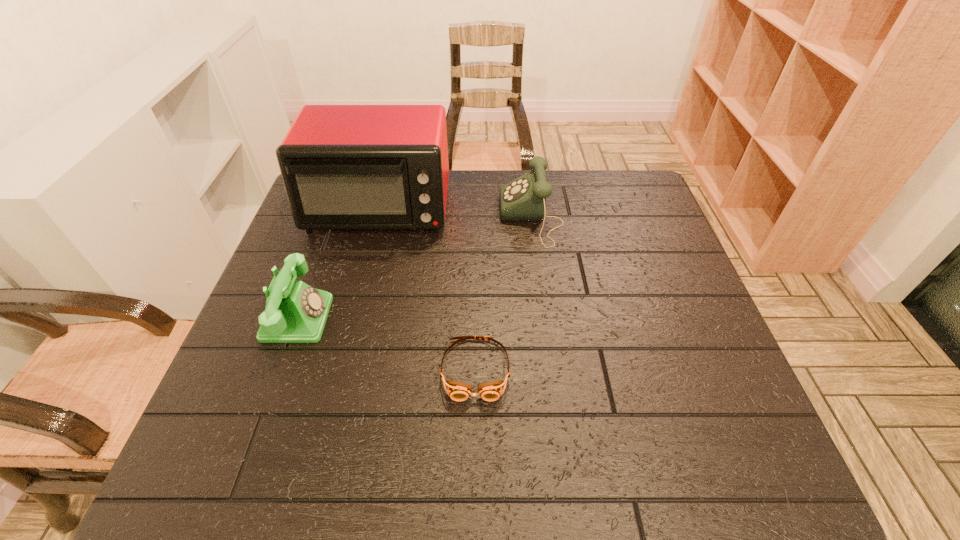
Identify the location of toaster oven. The width and height of the screenshot is (960, 540). (345, 167).

This screenshot has height=540, width=960. In order to click on the nearer telephone in this screenshot , I will do `click(295, 312)`.

The height and width of the screenshot is (540, 960). Identify the location of the right telephone. (523, 199).

In order to click on the shortest object in this screenshot , I will do `click(458, 391)`.

You are a GUI agent. You are given a task and a screenshot of the screen. Output one action in this format:
    pyautogui.click(x=<x>, y=<y>)
    Task: Click on the vacant space situated 0.060m on the front-facing side of the toaster oven
    The width and height of the screenshot is (960, 540).
    Given the screenshot: What is the action you would take?
    pyautogui.click(x=366, y=257)

Image resolution: width=960 pixels, height=540 pixels. I want to click on vacant space located on the dial of the left telephone, so click(x=389, y=318).

At what (x,y) coordinates should I click in order to perform the action: click on vacant space located 0.230m on the dial of the right telephone. Please return your answer as a coordinate pair (x, y). Looking at the image, I should click on (420, 218).

Where is `vacant space located 0.320m on the dial of the right telephone`? This screenshot has width=960, height=540. vacant space located 0.320m on the dial of the right telephone is located at coordinates (390, 218).

Identify the location of free space located on the dial of the right telephone. [x=483, y=218].

Locate an element on the screen. The image size is (960, 540). vacant region located with the lenses facing forward on the shortest object is located at coordinates [474, 483].